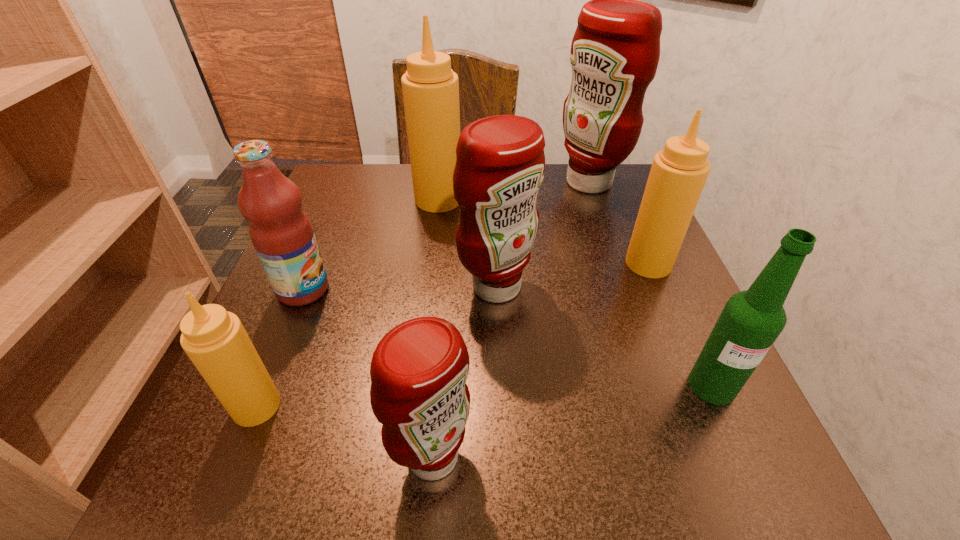
At what (x,y) coordinates should I click in order to perform the action: click on condiment that is the second closest to the rightmost tan condiment. Please return your answer as a coordinate pair (x, y). Looking at the image, I should click on (500, 164).

This screenshot has width=960, height=540. I want to click on condiment that is the second closest to the green beer bottle, so [500, 164].

Point out which red condiment is positioned as the second nearest to the leftmost tan condiment. Please provide its 2D coordinates. Your answer should be formatted as a tuple, i.e. [(x, y)], where the tuple contains the x and y coordinates of a point satisfying the conditions above.

[(500, 164)]

Image resolution: width=960 pixels, height=540 pixels. I want to click on the closest red condiment to the biggest red condiment, so coord(500,164).

This screenshot has height=540, width=960. In order to click on tan condiment that is the nearest to the second smallest tan condiment in this screenshot , I will do `click(430, 88)`.

Identify which tan condiment is the closest to the leftmost tan condiment. Please provide its 2D coordinates. Your answer should be formatted as a tuple, i.e. [(x, y)], where the tuple contains the x and y coordinates of a point satisfying the conditions above.

[(430, 88)]

Identify the location of vacant space that satisfies the following two spatial constraints: 1. on the front side of the second tan condiment from left to right; 2. on the front label of the fruit juice. (427, 289).

Locate an element on the screen. The image size is (960, 540). vacant area that satisfies the following two spatial constraints: 1. on the front label of the nearest tan condiment; 2. on the left side of the fruit juice is located at coordinates (254, 406).

The image size is (960, 540). I want to click on vacant area in the image that satisfies the following two spatial constraints: 1. on the back side of the rightmost tan condiment; 2. on the left side of the nearest tan condiment, so click(x=316, y=264).